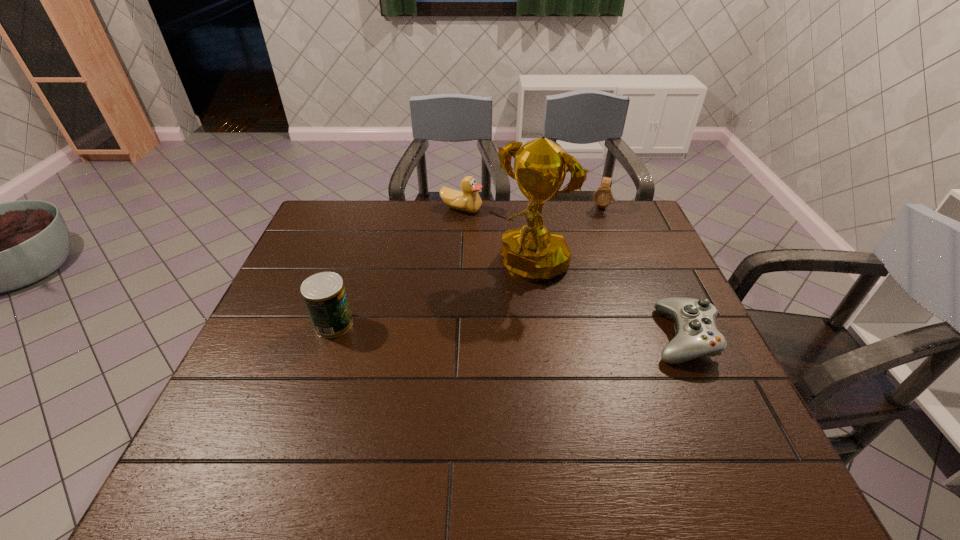
You are a GUI agent. You are given a task and a screenshot of the screen. Output one action in this format:
    pyautogui.click(x=<x>, y=<y>)
    Task: Click on the can
    The width and height of the screenshot is (960, 540).
    Given the screenshot: What is the action you would take?
    pyautogui.click(x=324, y=294)

Locate an element on the screen. control is located at coordinates (697, 335).

The width and height of the screenshot is (960, 540). In order to click on watch in this screenshot , I will do `click(603, 196)`.

Where is `award`? This screenshot has height=540, width=960. award is located at coordinates (532, 253).

Identify the location of the tallest object. (532, 253).

The image size is (960, 540). What are the coordinates of `the second object from left to right` in the screenshot? It's located at (468, 200).

You are a GUI agent. You are given a task and a screenshot of the screen. Output one action in this format:
    pyautogui.click(x=<x>, y=<y>)
    Task: Click on the free location located on the back of the can
    
    Given the screenshot: What is the action you would take?
    pyautogui.click(x=365, y=231)

You are a GUI agent. You are given a task and a screenshot of the screen. Output one action in this format:
    pyautogui.click(x=<x>, y=<y>)
    Task: Click on the free space located 0.060m on the left of the control
    
    Given the screenshot: What is the action you would take?
    pyautogui.click(x=626, y=336)

You are a GUI agent. You are given a task and a screenshot of the screen. Output one action in this format:
    pyautogui.click(x=<x>, y=<y>)
    Task: Click on the free space located 0.200m on the face of the watch
    The width and height of the screenshot is (960, 540).
    Given the screenshot: What is the action you would take?
    pyautogui.click(x=587, y=245)

Where is `free space located on the face of the watch`? The width and height of the screenshot is (960, 540). free space located on the face of the watch is located at coordinates (596, 221).